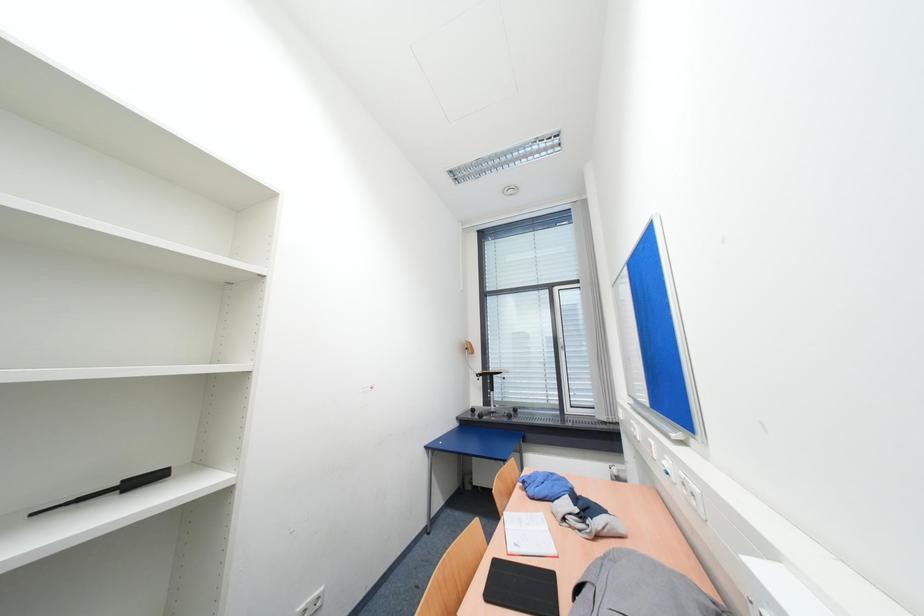
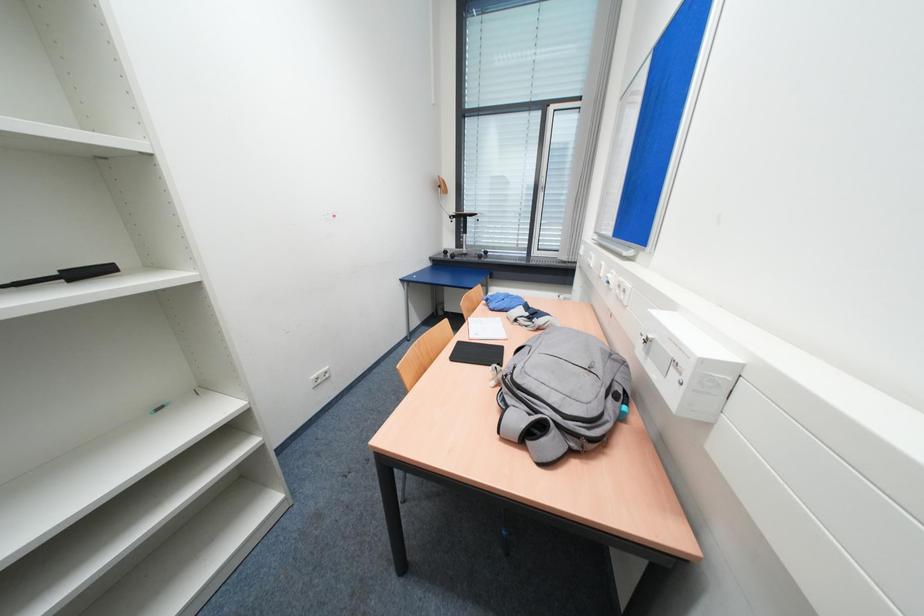
Question: Based on the continuous images, in which direction is the camera rotating? Reply with the corresponding letter.

Choices:
 (A) Left
 (B) Right
 (C) Up
 (D) Down

Answer: (D)